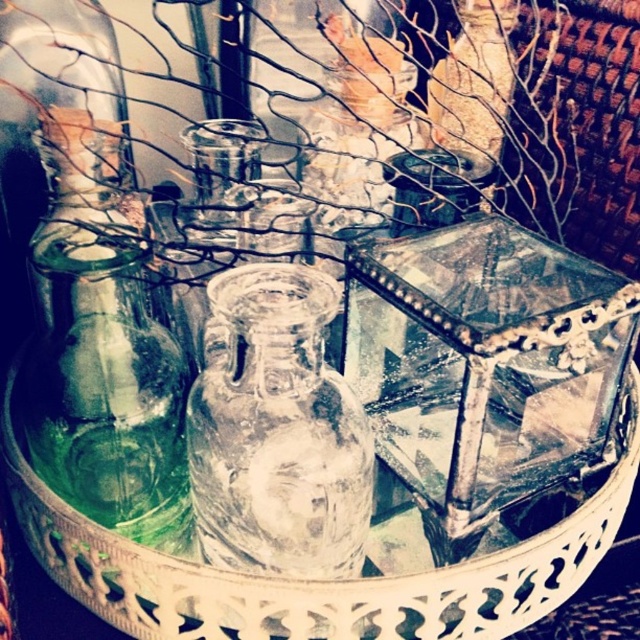
Question: Which point is farther to the camera?

Choices:
 (A) (x=211, y=488)
 (B) (x=38, y=284)

Answer: (B)

Question: Does green glass bottle at left appear on the left side of transparent glass vase at center?

Choices:
 (A) yes
 (B) no

Answer: (A)

Question: Which object is closer to the camera taking this photo?

Choices:
 (A) green glass bottle at left
 (B) transparent glass vase at center

Answer: (B)

Question: Among these objects, which one is farthest from the camera?

Choices:
 (A) transparent glass vase at center
 (B) green glass bottle at left

Answer: (B)

Question: Can you confirm if green glass bottle at left is positioned below transparent glass vase at center?

Choices:
 (A) no
 (B) yes

Answer: (A)

Question: Can you confirm if green glass bottle at left is positioned to the left of transparent glass vase at center?

Choices:
 (A) no
 (B) yes

Answer: (B)